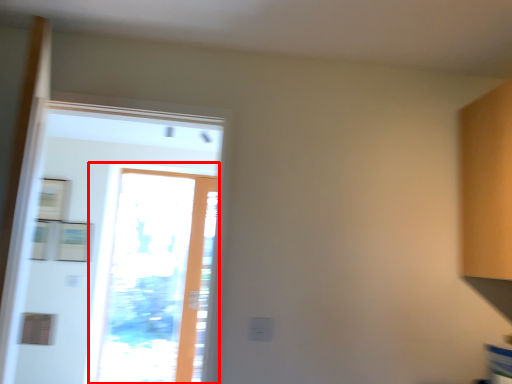
Question: From the image's perspective, considering the relative positions of window (annotated by the red box) and screen door in the image provided, where is window (annotated by the red box) located with respect to the staircase?

Choices:
 (A) above
 (B) below

Answer: (B)